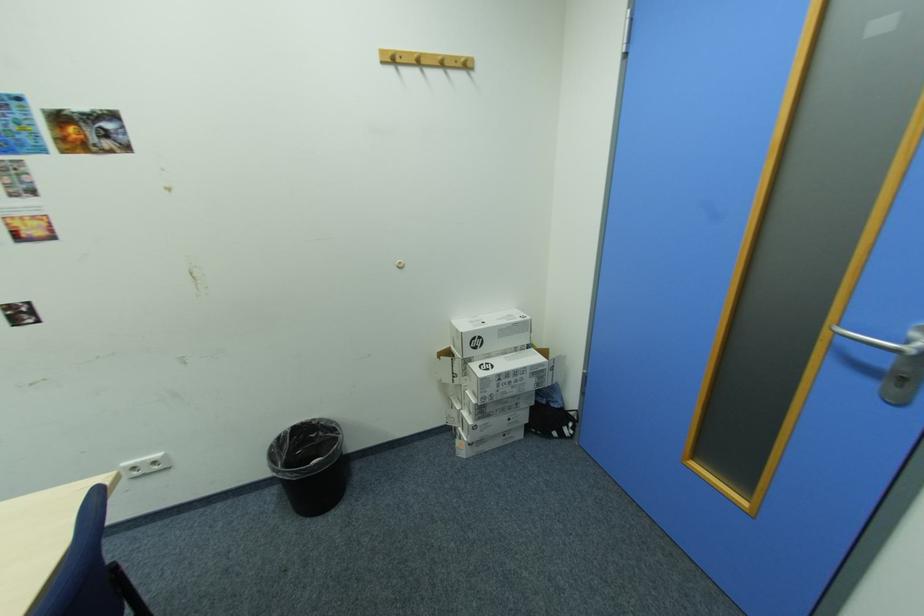
Identify the location of metal door handle. This screenshot has height=616, width=924. (881, 342).